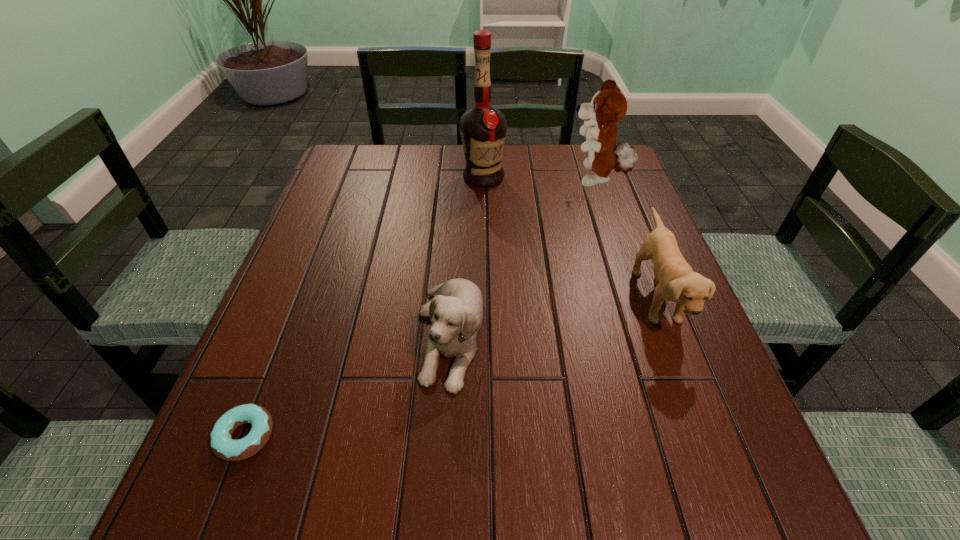
Point out which puppy is positioned as the second nearest to the tallest object. Please provide its 2D coordinates. Your answer should be formatted as a tuple, i.e. [(x, y)], where the tuple contains the x and y coordinates of a point satisfying the conditions above.

[(677, 282)]

At what (x,y) coordinates should I click in order to perform the action: click on free space that satisfies the following two spatial constraints: 1. on the face of the fourth shortest object; 2. on the front-facing side of the leftmost puppy. Please return your answer as a coordinate pair (x, y). The width and height of the screenshot is (960, 540). Looking at the image, I should click on (648, 334).

Find the location of a particular element. vacant space that satisfies the following two spatial constraints: 1. on the face of the fourth shortest object; 2. on the front-facing side of the leftmost puppy is located at coordinates (648, 334).